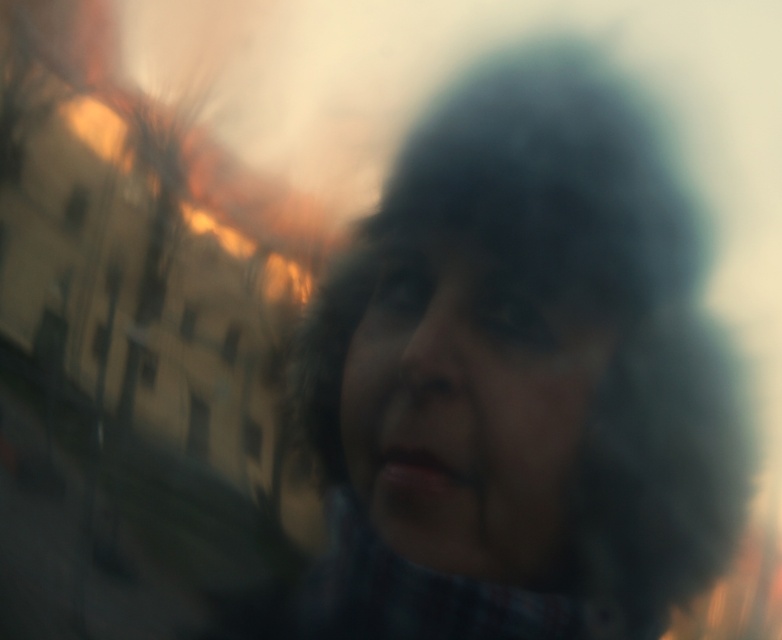
Looking at this image, you are a photographer trying to adjust the focus of your camera to capture the dark hair at center in the image. The camera has a focus point at point (x=519, y=380). Is this focus point correctly positioned to capture the dark hair at center?

Yes, the focus point at point (x=519, y=380) is correctly positioned to capture the dark hair at center as the dark hair at center is represented by point (x=519, y=380).

You are a photographer analyzing this image. You notice the dark hair at center and the smooth skin face at center. Which object is located lower in the frame?

The dark hair at center is positioned under smooth skin face at center, so the dark hair at center is lower in the frame.